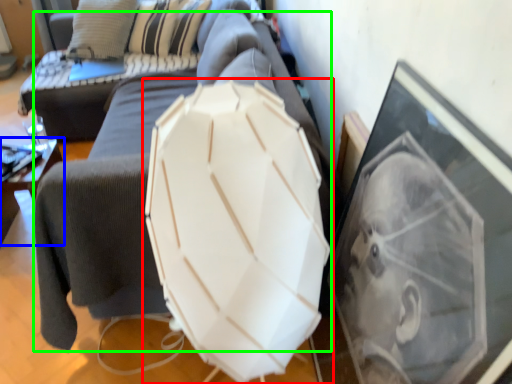
Question: Which is nearer to the umbrella (highlighted by a red box)? furniture (highlighted by a blue box) or swivel chair (highlighted by a green box).

Choices:
 (A) furniture
 (B) swivel chair

Answer: (B)